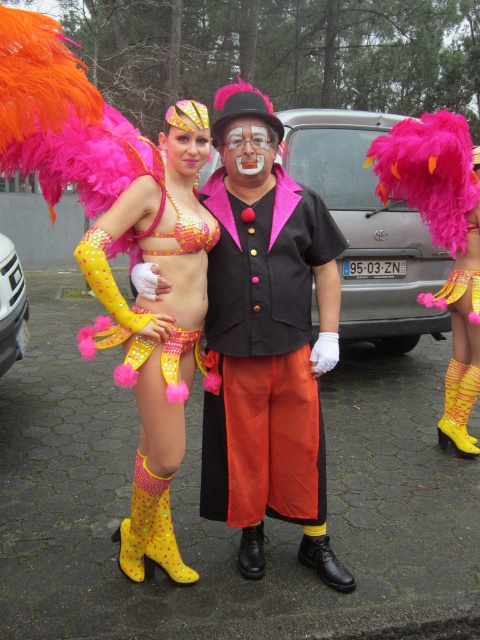
Does matte yellow sequined bikini top at center come behind fuzzy pink feathers at right?

No, matte yellow sequined bikini top at center is closer to the viewer.

Can you confirm if matte yellow sequined bikini top at center is positioned to the right of fuzzy pink feathers at right?

No, matte yellow sequined bikini top at center is not to the right of fuzzy pink feathers at right.

Between point (134, 326) and point (477, 195), which one is positioned behind?

Positioned behind is point (477, 195).

Find the location of a particular element. matte yellow sequined bikini top at center is located at coordinates (156, 324).

Which is more to the left, matte yellow costume at center or matte yellow sequined bikini top at center?

From the viewer's perspective, matte yellow sequined bikini top at center appears more on the left side.

Does matte yellow costume at center have a greater width compared to matte yellow sequined bikini top at center?

Indeed, matte yellow costume at center has a greater width compared to matte yellow sequined bikini top at center.

In the scene shown: Who is more distant from viewer, (217, 269) or (116, 376)?

The point (116, 376) is more distant.

Find the location of a particular element. The width and height of the screenshot is (480, 640). matte yellow costume at center is located at coordinates tap(266, 340).

Who is positioned more to the right, matte yellow costume at center or fuzzy pink feathers at right?

fuzzy pink feathers at right

Which of these two, matte yellow costume at center or fuzzy pink feathers at right, stands taller?

Standing taller between the two is fuzzy pink feathers at right.

Is point (283, 410) farther from viewer compared to point (430, 208)?

That is False.

The width and height of the screenshot is (480, 640). Identify the location of matte yellow costume at center. (266, 340).